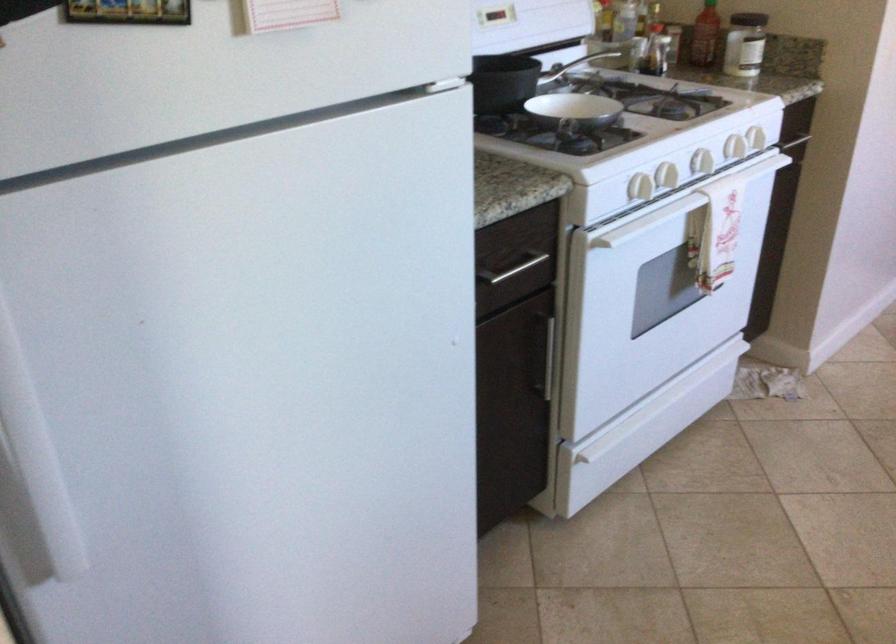
Where would you pull the oven drawer handle? Please return your answer as a coordinate pair (x, y).

(679, 205)